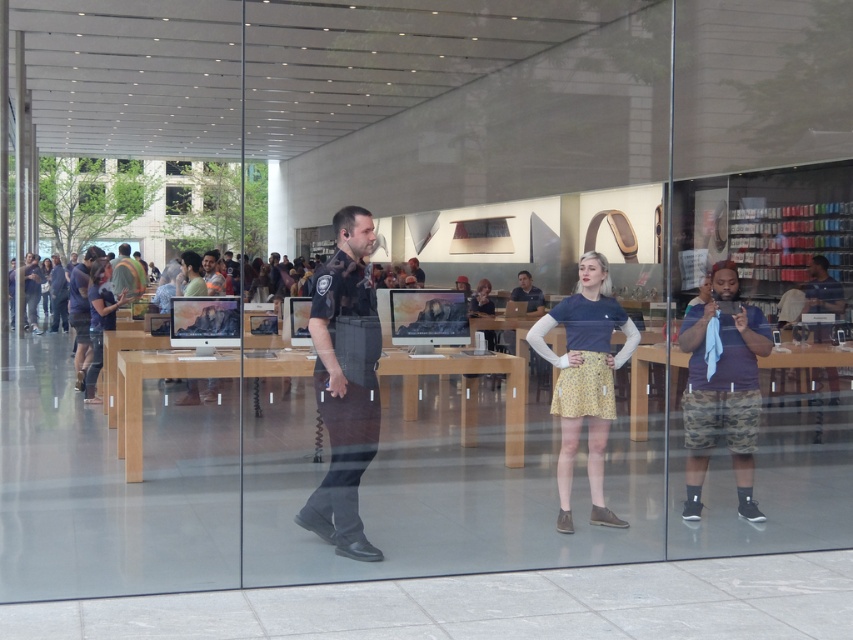
What do you see at coordinates (345, 381) in the screenshot? The image size is (853, 640). I see `black uniformed officer at center` at bounding box center [345, 381].

Which is more to the right, black uniformed officer at center or dark blue shirt at center?

Positioned to the right is dark blue shirt at center.

At what (x,y) coordinates should I click in order to perform the action: click on black uniformed officer at center. Please return your answer as a coordinate pair (x, y). The height and width of the screenshot is (640, 853). Looking at the image, I should click on (x=345, y=381).

Is black uniformed officer at center shorter than orange safety vest at center?

No, black uniformed officer at center is not shorter than orange safety vest at center.

Can you confirm if black uniformed officer at center is positioned to the left of orange safety vest at center?

In fact, black uniformed officer at center is to the right of orange safety vest at center.

Is point (335, 300) closer to viewer compared to point (128, 257)?

Yes, it is.

Where is `black uniformed officer at center`? This screenshot has width=853, height=640. black uniformed officer at center is located at coordinates (345, 381).

Does yellow floral skirt at center appear on the right side of matte black shirt at center?

Correct, you'll find yellow floral skirt at center to the right of matte black shirt at center.

Identify the location of yellow floral skirt at center. (585, 378).